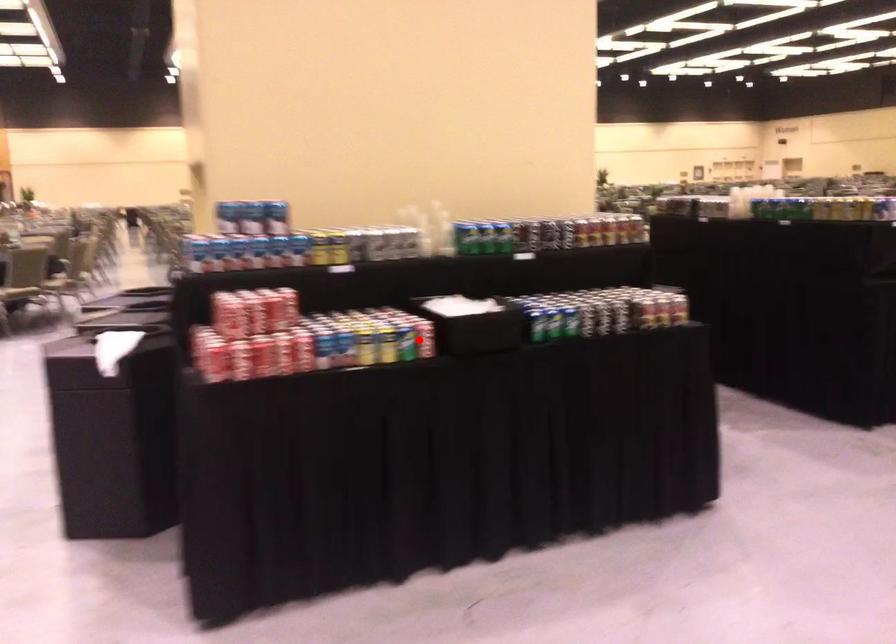
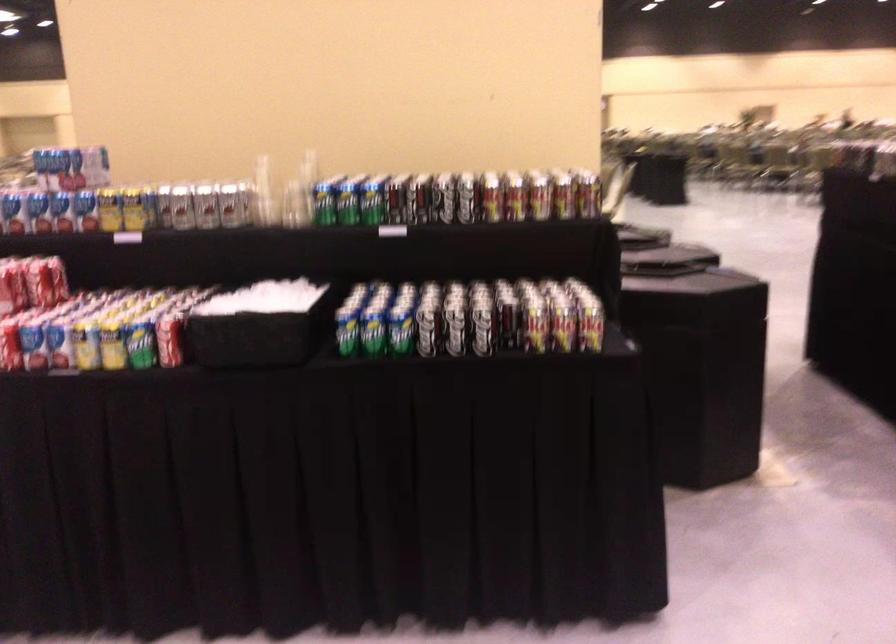
Question: I am providing you with two images of the same scene from different viewpoints. A red point is marked on the first image. Can you still see the location of the red point in image 2?

Choices:
 (A) Yes
 (B) No

Answer: (A)